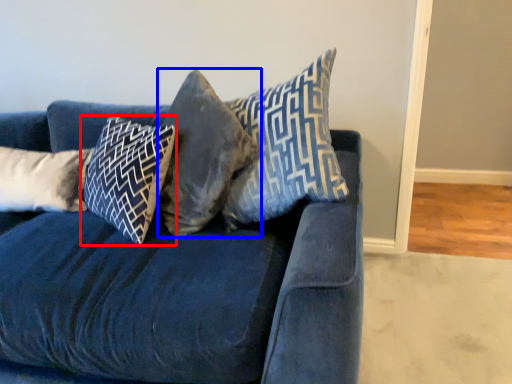
Question: Among these objects, which one is farthest to the camera, pillow (highlighted by a red box) or pillow (highlighted by a blue box)?

Choices:
 (A) pillow
 (B) pillow

Answer: (A)